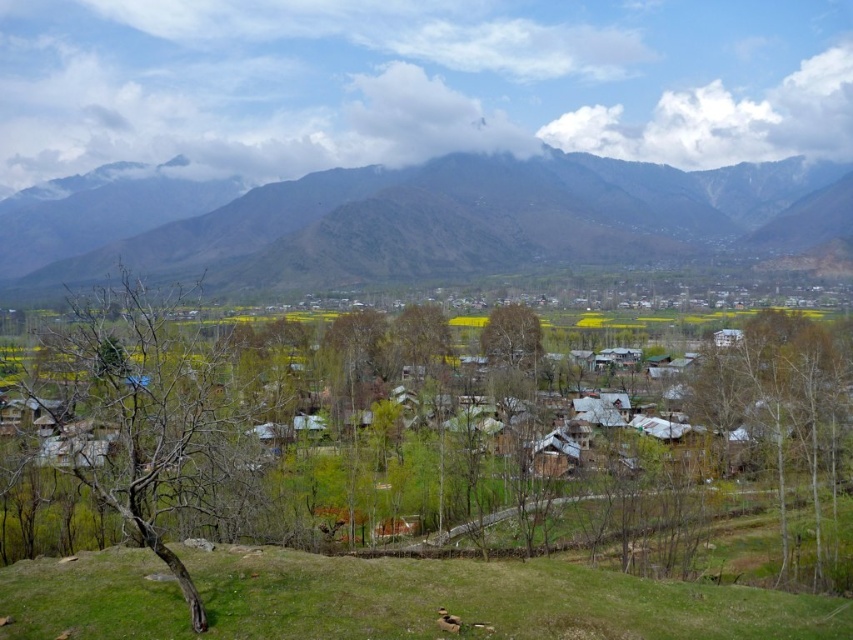
You are a hiker planning to take a photo of the brown rocky mountain at upper center. According to the image, where exactly should you position your camera to capture it in the frame?

The brown rocky mountain at upper center is located at coordinates point [479,221], so you should position your camera at that point to capture it in the frame.